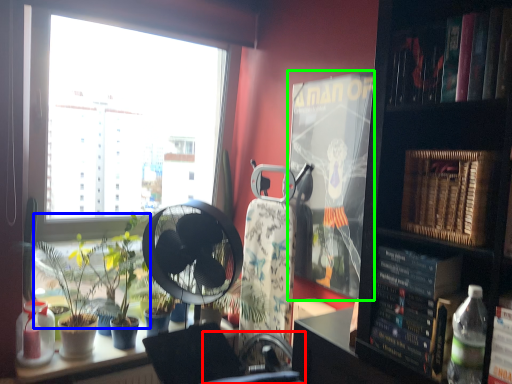
Question: Which object is positioned closest to swivel chair (highlighted by a red box)? Select from plant (highlighted by a blue box) and paperback book (highlighted by a green box).

Choices:
 (A) plant
 (B) paperback book

Answer: (A)